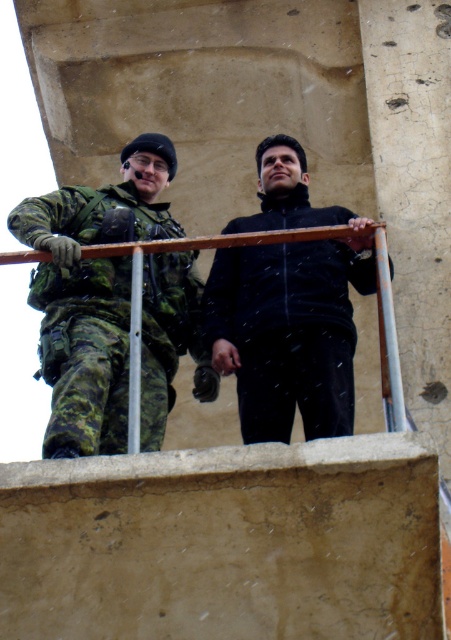
You are a photographer trying to capture both the camouflage fabric uniform at left and the black matte jacket at center in a single shot. Which subject should you focus on first to ensure both are in clear focus?

You should focus on the camouflage fabric uniform at left first since it is closer to the viewer than the black matte jacket at center, ensuring both will be in focus when using depth of field appropriately.

You are a photographer trying to capture both the camouflage fabric uniform at left and the black matte jacket at center in a single frame. Based on their sizes, which one should you focus on to ensure both fit in the photo without cropping?

The camouflage fabric uniform at left is wider than the black matte jacket at center, so you should focus on the camouflage fabric uniform at left to ensure both fit in the photo without cropping.

You are a photographer trying to capture both the camouflage fabric uniform at left and the black matte jacket at center in a single frame. Based on their heights, which one should you adjust your camera angle to focus on first to ensure both are visible?

Since the camouflage fabric uniform at left is taller than the black matte jacket at center, you should focus on the camouflage fabric uniform at left first to ensure the camera captures the full height of both subjects.